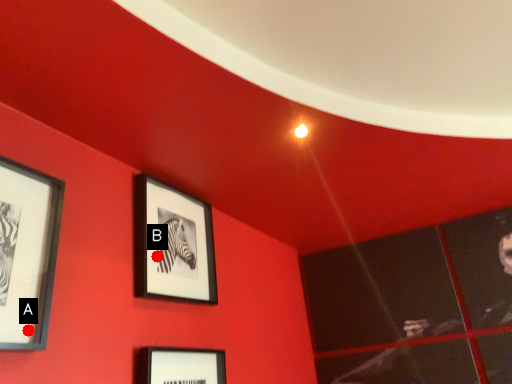
Question: Two points are circled on the image, labeled by A and B beside each circle. Among these points, which one is nearest to the camera?

Choices:
 (A) A is closer
 (B) B is closer

Answer: (A)